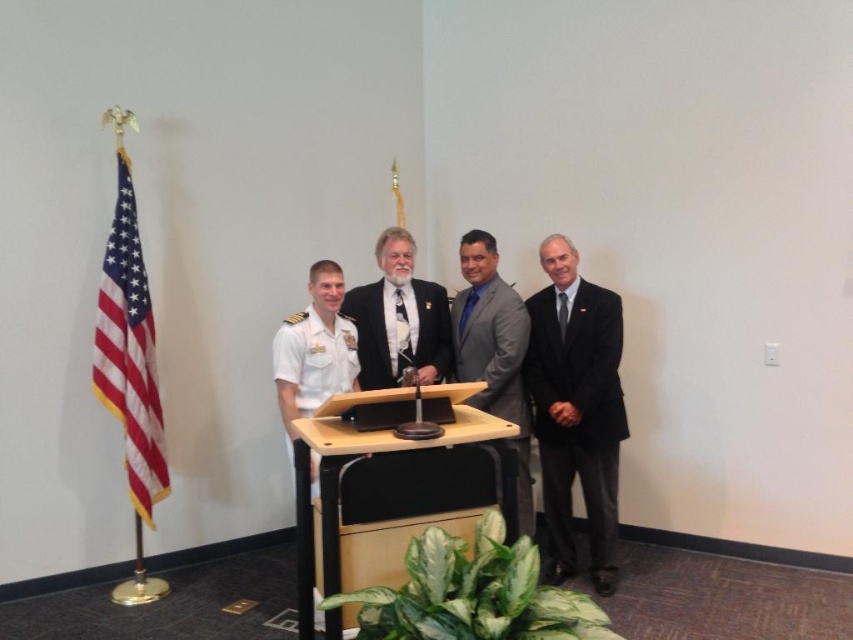
You are a photographer positioned behind the podium. You want to capture a photo that includes both the american flag at left and the gray matte suit at center. Given that your camera has a maximum focus range of 1.5 meters, will you be able to ensure both subjects are in focus?

The distance between the american flag at left and gray matte suit at center is 1.54 meters, which exceeds the camera maximum focus range of 1.5 meters. Therefore, both subjects cannot be in focus simultaneously.

You are organizing a photo shoot and need to ensure that the gray matte suit at center and the matte black suit at center are visible in the final image. Given their sizes, which suit should you focus on to ensure it doesn

The gray matte suit at center is larger in size than the matte black suit at center, so focusing on the gray matte suit at center will ensure it is visible in the final image.

You are organizing a photo shoot and need to ensure proper positioning for the subjects. Given the scene described, which object, the gray matte suit at center or the light brown wood podium at center, is located to the right of the other?

The gray matte suit at center is positioned on the right side of the light brown wood podium at center.